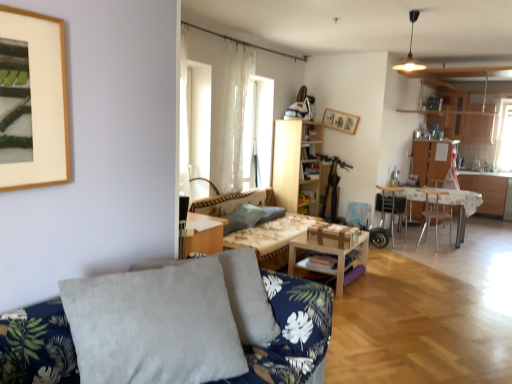
Question: Is woodenobject at center to the right of metallic silver chair at right, the 1th chair when ordered from left to right, from the viewer's perspective?

Choices:
 (A) no
 (B) yes

Answer: (A)

Question: Is woodenobject at center turned away from metallic silver chair at right, which is counted as the second chair, starting from the right?

Choices:
 (A) no
 (B) yes

Answer: (A)

Question: From a real-world perspective, is woodenobject at center beneath metallic silver chair at right, the 1th chair when ordered from left to right?

Choices:
 (A) no
 (B) yes

Answer: (B)

Question: Would you say metallic silver chair at right, the 1th chair when ordered from left to right, is part of woodenobject at center's contents?

Choices:
 (A) no
 (B) yes

Answer: (A)

Question: Is woodenobject at center far from metallic silver chair at right, which is counted as the second chair, starting from the right?

Choices:
 (A) yes
 (B) no

Answer: (A)

Question: From a real-world perspective, is wooden bookshelf at center physically located above or below translucent fabric at center?

Choices:
 (A) above
 (B) below

Answer: (B)

Question: Considering the relative positions of wooden bookshelf at center and translucent fabric at center in the image provided, is wooden bookshelf at center to the left or to the right of translucent fabric at center?

Choices:
 (A) right
 (B) left

Answer: (A)

Question: Is wooden bookshelf at center wider or thinner than translucent fabric at center?

Choices:
 (A) thin
 (B) wide

Answer: (A)

Question: From the image's perspective, is wooden bookshelf at center above or below translucent fabric at center?

Choices:
 (A) above
 (B) below

Answer: (B)

Question: Considering the relative positions of metallic silver chair at center, the first chair positioned from the right, and matte gold light fixture at upper center in the image provided, is metallic silver chair at center, the first chair positioned from the right, to the left or to the right of matte gold light fixture at upper center?

Choices:
 (A) right
 (B) left

Answer: (A)

Question: Considering the positions of metallic silver chair at center, positioned as the 2th chair in left-to-right order, and matte gold light fixture at upper center in the image, is metallic silver chair at center, positioned as the 2th chair in left-to-right order, wider or thinner than matte gold light fixture at upper center?

Choices:
 (A) thin
 (B) wide

Answer: (B)

Question: From the image's perspective, relative to matte gold light fixture at upper center, is metallic silver chair at center, the first chair positioned from the right, above or below?

Choices:
 (A) below
 (B) above

Answer: (A)

Question: Is metallic silver chair at center, the first chair positioned from the right, spatially inside matte gold light fixture at upper center, or outside of it?

Choices:
 (A) inside
 (B) outside

Answer: (B)

Question: In the image, is sheer white curtain at center on the left side or the right side of matte gold light fixture at upper center?

Choices:
 (A) left
 (B) right

Answer: (A)

Question: Is sheer white curtain at center wider or thinner than matte gold light fixture at upper center?

Choices:
 (A) thin
 (B) wide

Answer: (A)